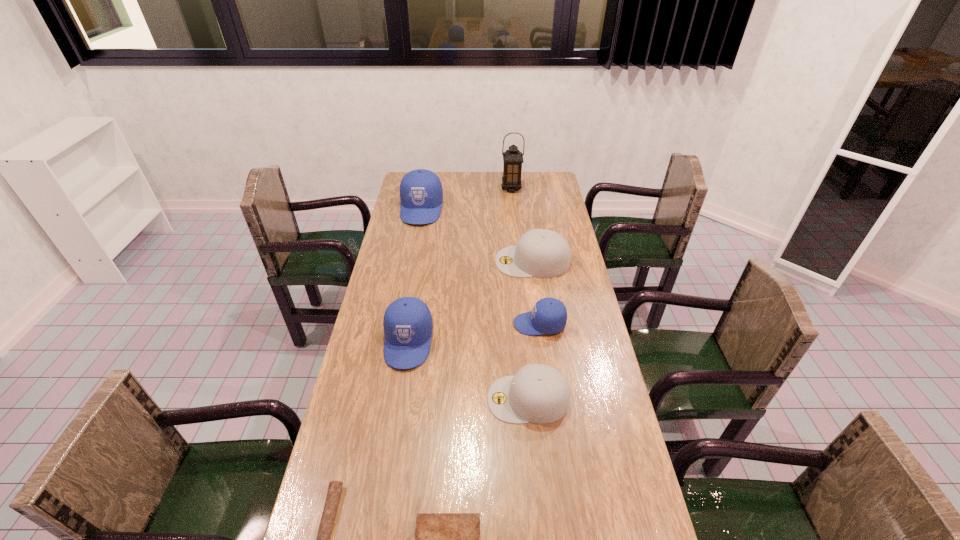
Find the location of `free space located 0.300m on the front-facing side of the rightmost blue cap`. free space located 0.300m on the front-facing side of the rightmost blue cap is located at coordinates (426, 324).

Identify the location of vacant space located on the front-facing side of the rightmost blue cap. (415, 324).

Where is `lantern located in the far edge section of the desktop`? This screenshot has width=960, height=540. lantern located in the far edge section of the desktop is located at coordinates (513, 158).

Locate an element on the screen. The width and height of the screenshot is (960, 540). cap located at the far edge is located at coordinates (421, 194).

Where is `object at the far left corner`? object at the far left corner is located at coordinates (421, 194).

Locate an element on the screen. This screenshot has height=540, width=960. vacant space at the far edge is located at coordinates (466, 179).

This screenshot has height=540, width=960. I want to click on vacant region at the left edge, so click(360, 385).

In the image, there is a desktop. At what (x,y) coordinates should I click in order to perform the action: click on vacant space at the right edge. Please return your answer as a coordinate pair (x, y). This screenshot has height=540, width=960. Looking at the image, I should click on (583, 359).

At what (x,y) coordinates should I click in order to perform the action: click on unoccupied position between the tallest object and the farthest cap. Please return your answer as a coordinate pair (x, y). Image resolution: width=960 pixels, height=540 pixels. Looking at the image, I should click on (467, 199).

Identify the location of free spot between the tallest cap and the bigger gray cap. Image resolution: width=960 pixels, height=540 pixels. click(477, 235).